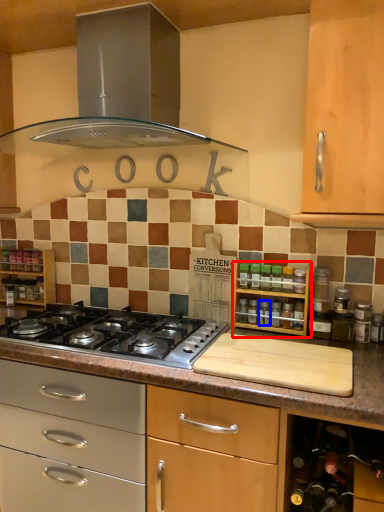
Question: Which object appears farthest to the camera in this image, shelf (highlighted by a red box) or appliance (highlighted by a blue box)?

Choices:
 (A) shelf
 (B) appliance

Answer: (B)